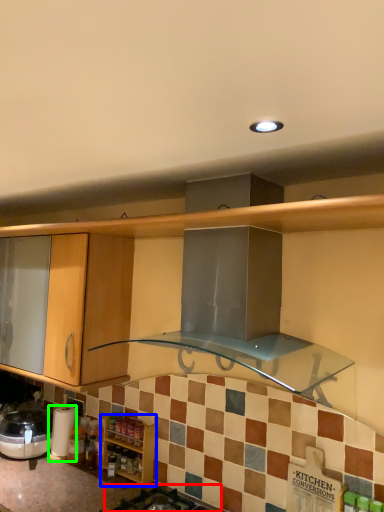
Question: Considering the real-world distances, which object is closest to gas stove (highlighted by a red box)? cabinetry (highlighted by a blue box) or appliance (highlighted by a green box).

Choices:
 (A) cabinetry
 (B) appliance

Answer: (A)